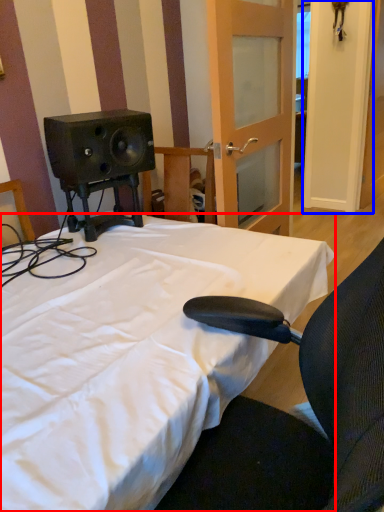
Question: Among these objects, which one is nearest to the camera, bed (highlighted by a red box) or door (highlighted by a blue box)?

Choices:
 (A) bed
 (B) door

Answer: (A)